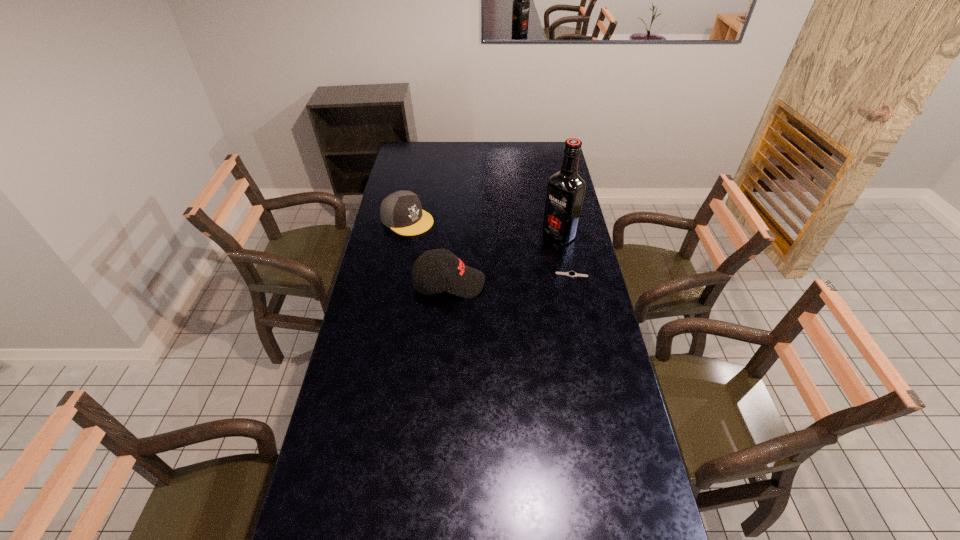
I want to click on free spot located on the front-facing side of the cap, so click(x=441, y=239).

Identify the location of vacant space located on the front-facing side of the cap. pos(447,242).

This screenshot has width=960, height=540. In order to click on object present at the left edge in this screenshot , I will do `click(401, 211)`.

The width and height of the screenshot is (960, 540). Identify the location of watch located at the right edge. (571, 273).

In order to click on liquor at the right edge in this screenshot , I will do `click(565, 193)`.

Locate an element on the screen. Image resolution: width=960 pixels, height=540 pixels. free space at the far edge is located at coordinates (520, 145).

The height and width of the screenshot is (540, 960). What are the coordinates of `free point at the near edge` in the screenshot? It's located at (512, 509).

In the image, there is a desktop. Where is `vacant space at the left edge`? This screenshot has height=540, width=960. vacant space at the left edge is located at coordinates (363, 291).

The height and width of the screenshot is (540, 960). I want to click on vacant space at the right edge of the desktop, so pos(563,258).

The height and width of the screenshot is (540, 960). In the image, there is a desktop. In order to click on free space at the near left corner in this screenshot , I will do `click(339, 515)`.